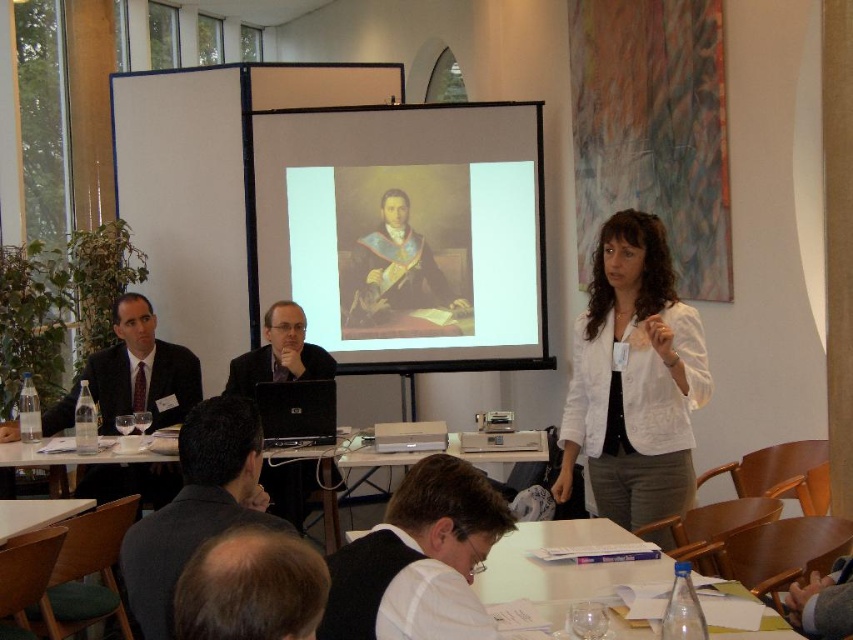
Does white textured blazer at center appear over white shirt at lower center?

Correct, white textured blazer at center is located above white shirt at lower center.

Does point (614, 232) lie in front of point (471, 531)?

No.

Identify the location of white textured blazer at center. [633, 380].

Between white plastic table at center and black plastic laptop at center, which one is positioned higher?

Positioned higher is black plastic laptop at center.

Who is more forward, (535, 435) or (293, 417)?

Positioned in front is point (535, 435).

Which is behind, point (9, 532) or point (306, 401)?

The point (306, 401) is more distant.

Find the location of a particular element. The height and width of the screenshot is (640, 853). white plastic table at center is located at coordinates (x=68, y=454).

Is white textured blazer at center to the right of white matte table at lower left from the viewer's perspective?

Correct, you'll find white textured blazer at center to the right of white matte table at lower left.

Is white textured blazer at center smaller than white matte table at lower left?

No.

At what (x,y) coordinates should I click in order to perform the action: click on white textured blazer at center. Please return your answer as a coordinate pair (x, y). The width and height of the screenshot is (853, 640). Looking at the image, I should click on (633, 380).